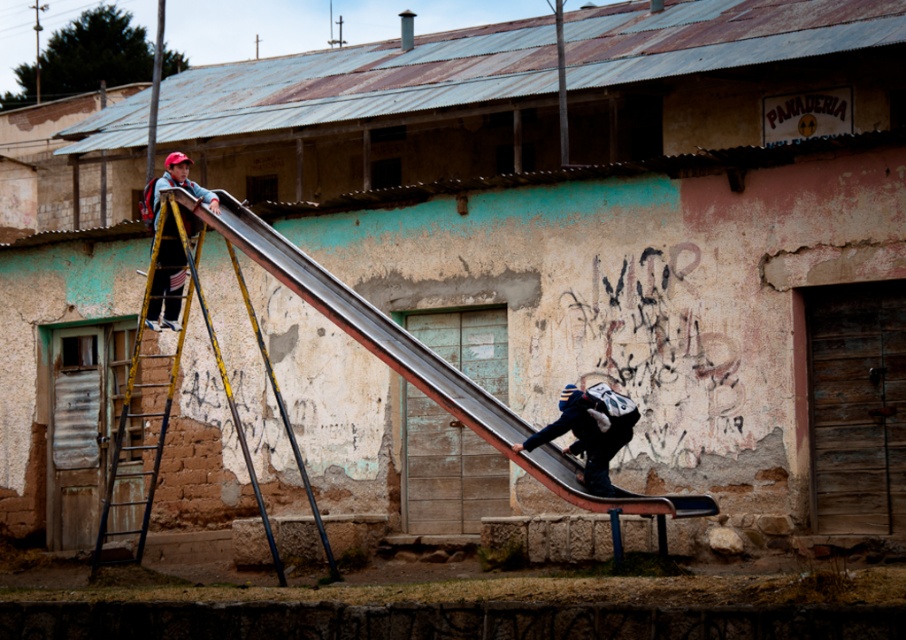
Can you confirm if metallic smooth slide at center is wider than dark blue fabric backpack at lower right?

No.

Is point (246, 234) farther from viewer compared to point (593, 387)?

No.

Which is behind, point (468, 390) or point (523, 445)?

The point (468, 390) is behind.

In order to click on metallic smooth slide at center in this screenshot , I will do 425,364.

Which is above, dark blue fabric backpack at lower right or matte yellow ladder at left?

Positioned higher is matte yellow ladder at left.

Consider the image. Who is more forward, (590, 394) or (170, 316)?

Point (590, 394) is more forward.

Locate an element on the screen. dark blue fabric backpack at lower right is located at coordinates (590, 432).

Consider the image. Measure the distance between yellow metal ladder at upper left and dark blue fabric backpack at lower right.

They are 5.84 meters apart.

The width and height of the screenshot is (906, 640). What do you see at coordinates (174, 381) in the screenshot?
I see `yellow metal ladder at upper left` at bounding box center [174, 381].

Where is `yellow metal ladder at upper left`? Image resolution: width=906 pixels, height=640 pixels. yellow metal ladder at upper left is located at coordinates (174, 381).